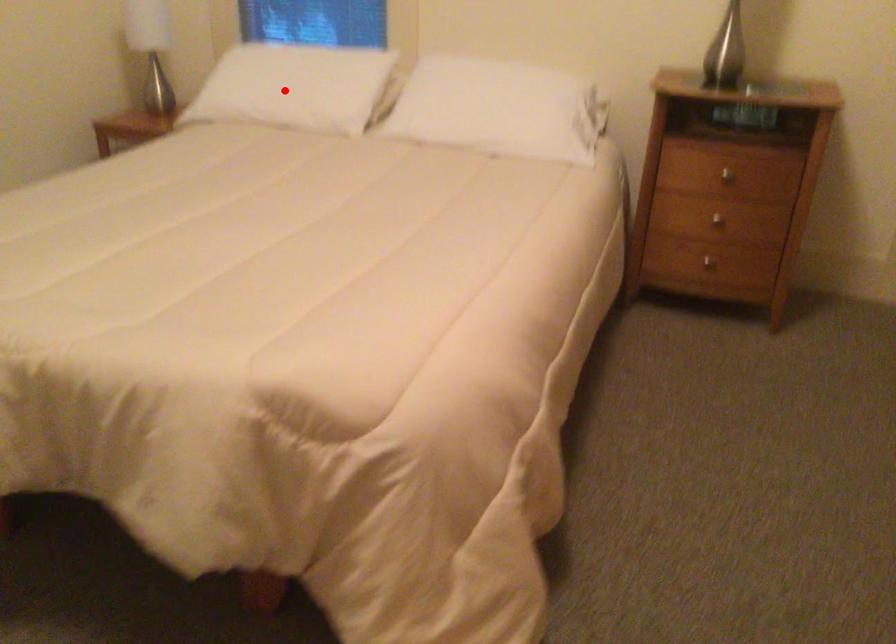
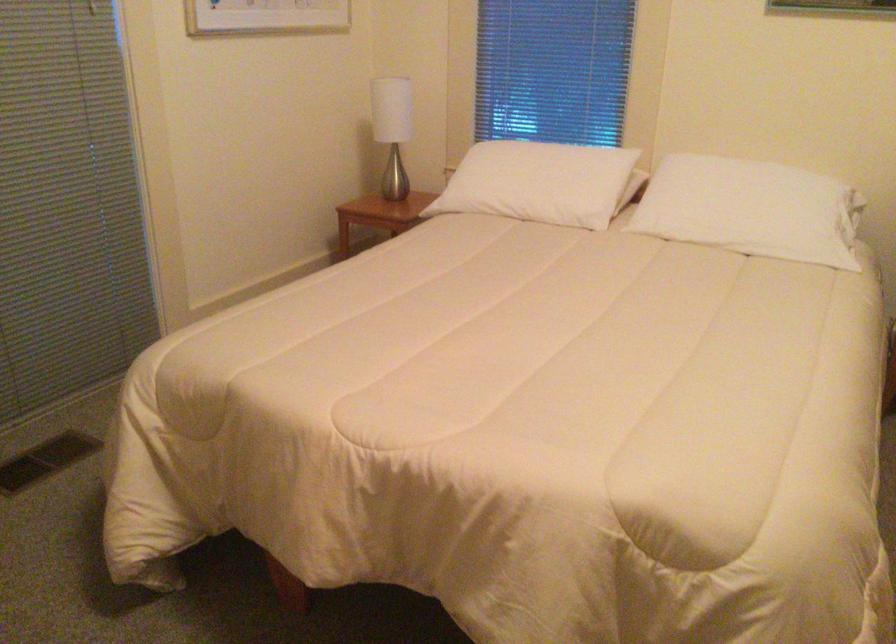
Where in the second image is the point corresponding to the highlighted location from the first image?

(538, 183)